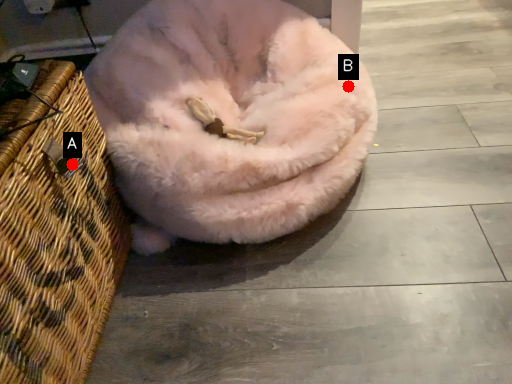
Question: Two points are circled on the image, labeled by A and B beside each circle. Which point is closer to the camera?

Choices:
 (A) A is closer
 (B) B is closer

Answer: (A)